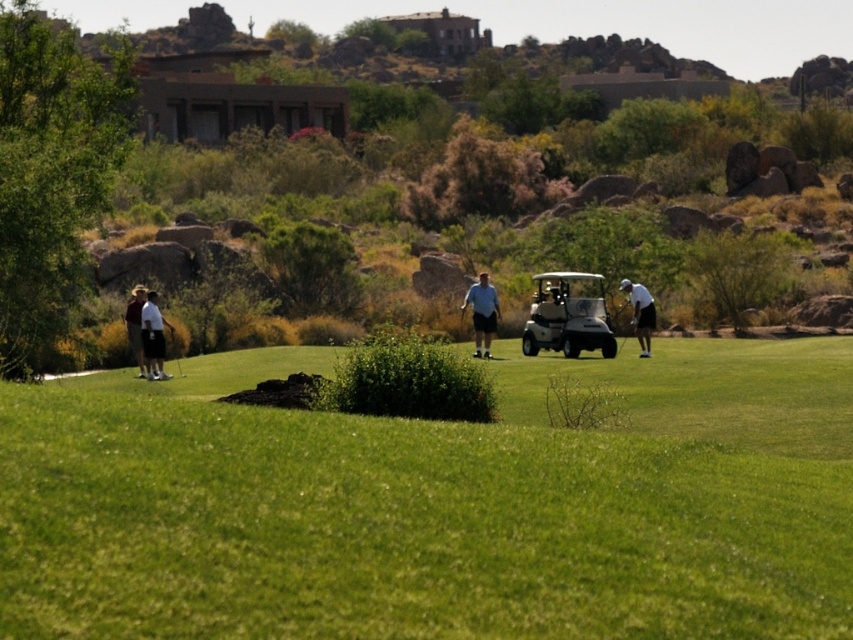
Question: Considering the real-world distances, which object is farthest from the white matte golf club at left?

Choices:
 (A) green grassy field at center
 (B) white matte golf club at center
 (C) brown leather hat at left

Answer: (B)

Question: Which of the following is the farthest from the observer?

Choices:
 (A) (641, 332)
 (B) (126, 323)
 (C) (486, 317)

Answer: (C)

Question: Is green grassy field at center to the right of white matte golf cart at center from the viewer's perspective?

Choices:
 (A) no
 (B) yes

Answer: (A)

Question: Can you confirm if green grassy field at center is bigger than metallic silver golf club at left?

Choices:
 (A) no
 (B) yes

Answer: (B)

Question: Considering the relative positions of white matte golf cart at center and brown leather hat at left in the image provided, where is white matte golf cart at center located with respect to brown leather hat at left?

Choices:
 (A) below
 (B) above

Answer: (A)

Question: Among these points, which one is farthest from the camera?

Choices:
 (A) (151, 372)
 (B) (138, 285)
 (C) (622, 340)
 (D) (592, 278)

Answer: (B)